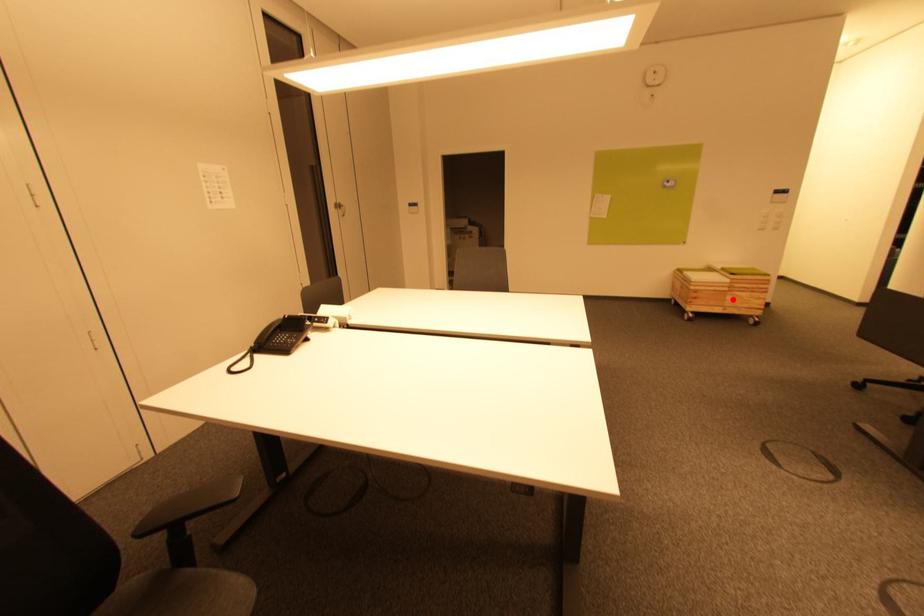
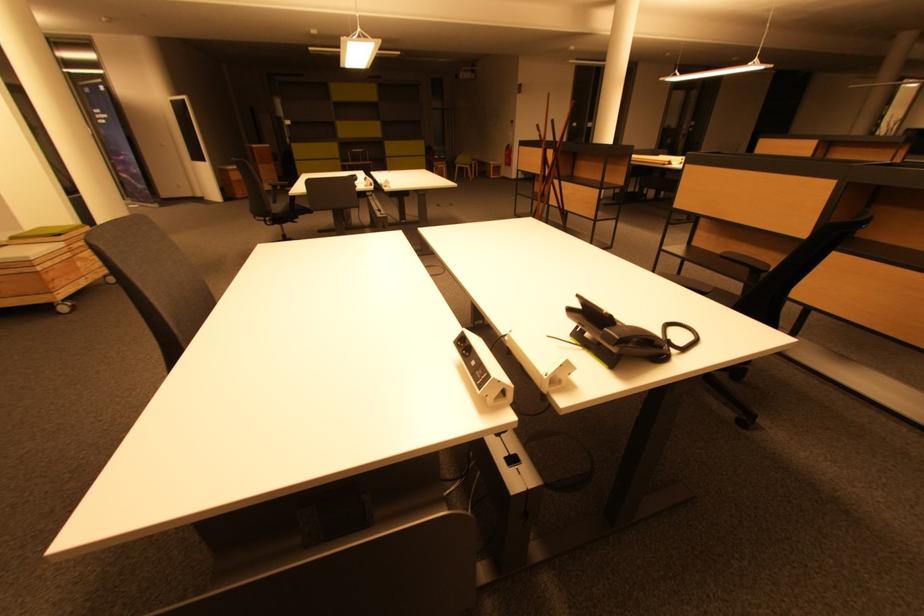
Locate, in the second image, the point that corresponds to the highlighted location in the first image.

(83, 265)